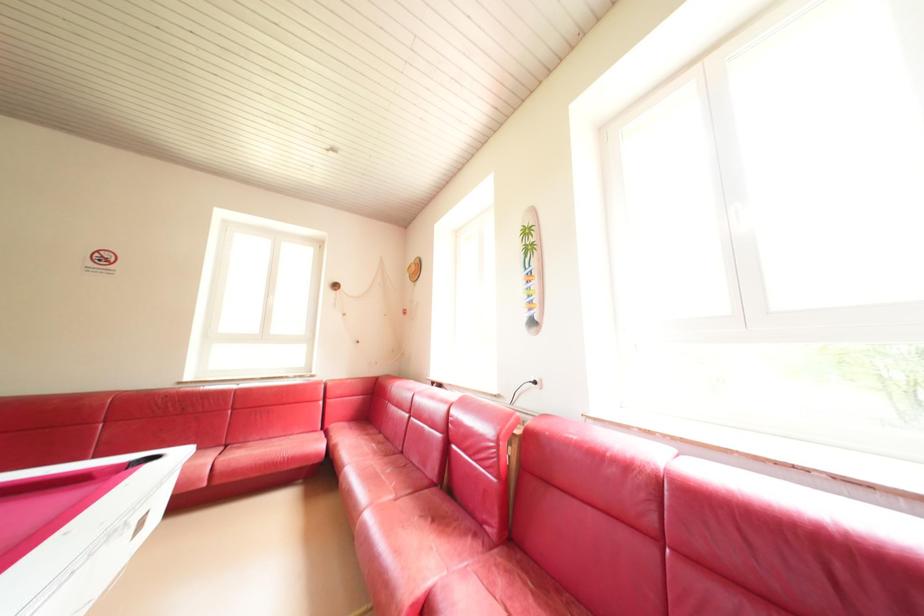
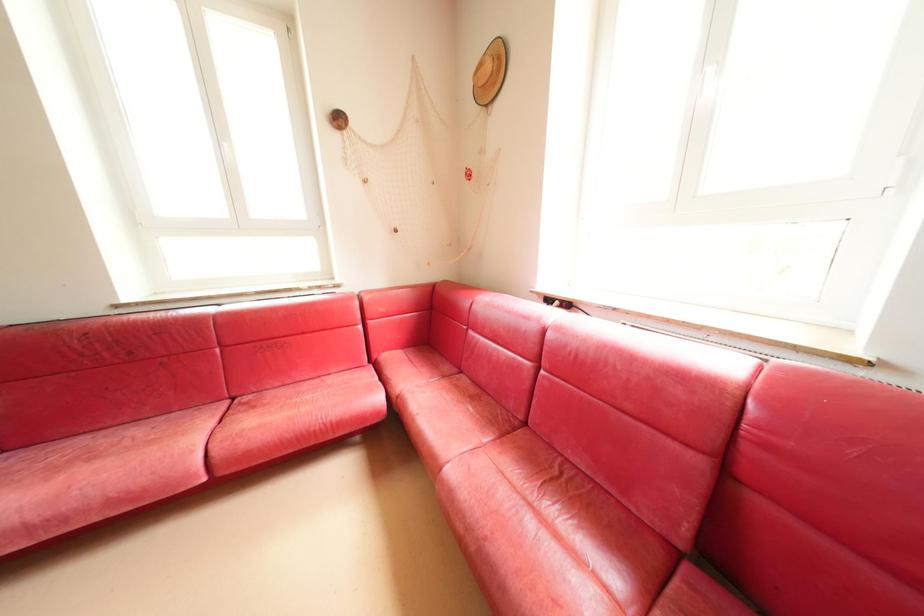
Which direction would the cameraman need to move to produce the second image?

The cameraman moved toward left, forward.